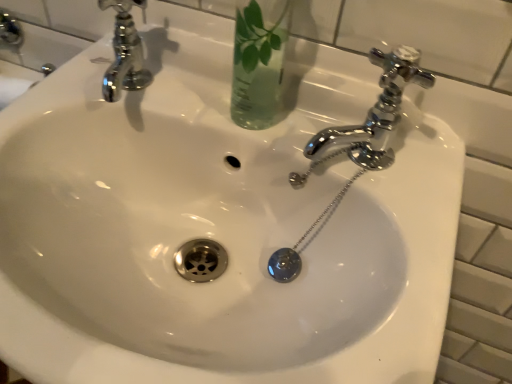
In order to face chrome/metallic faucet at right, should I rotate leftwards or rightwards?

You should rotate right by 17.047 degrees.

I want to click on chrome/metallic faucet at right, so click(x=377, y=111).

The width and height of the screenshot is (512, 384). What do you see at coordinates (377, 111) in the screenshot?
I see `chrome/metallic faucet at right` at bounding box center [377, 111].

This screenshot has width=512, height=384. I want to click on transparent glass vase at upper center, so 258,62.

What do you see at coordinates (258, 62) in the screenshot?
I see `transparent glass vase at upper center` at bounding box center [258, 62].

Based on the photo, in order to face transparent glass vase at upper center, should I rotate leftwards or rightwards?

A 2.742 degree turn to the right will do.

Where is `chrome/metallic faucet at right`? The image size is (512, 384). chrome/metallic faucet at right is located at coordinates (377, 111).

Between transparent glass vase at upper center and chrome/metallic faucet at right, which one appears on the left side from the viewer's perspective?

transparent glass vase at upper center is more to the left.

Considering the positions of objects transparent glass vase at upper center and chrome/metallic faucet at right in the image provided, who is in front, transparent glass vase at upper center or chrome/metallic faucet at right?

transparent glass vase at upper center is closer to the camera.

Which is farther, [240,24] or [371,146]?

Point [371,146]

From the image's perspective, which one is positioned lower, transparent glass vase at upper center or chrome/metallic faucet at right?

chrome/metallic faucet at right is shown below in the image.

From a real-world perspective, who is located lower, transparent glass vase at upper center or chrome/metallic faucet at right?

chrome/metallic faucet at right.

Which of these two, transparent glass vase at upper center or chrome/metallic faucet at right, is wider?

With larger width is transparent glass vase at upper center.

Looking at this image, does transparent glass vase at upper center have a greater height compared to chrome/metallic faucet at right?

Correct, transparent glass vase at upper center is much taller as chrome/metallic faucet at right.

Which of these two, transparent glass vase at upper center or chrome/metallic faucet at right, is bigger?

transparent glass vase at upper center.

Would you say transparent glass vase at upper center is inside or outside chrome/metallic faucet at right?

transparent glass vase at upper center is not enclosed by chrome/metallic faucet at right.

Is transparent glass vase at upper center with chrome/metallic faucet at right?

They are not placed beside each other.

Is transparent glass vase at upper center facing away from chrome/metallic faucet at right?

No, transparent glass vase at upper center's orientation is not away from chrome/metallic faucet at right.

What's the angular difference between transparent glass vase at upper center and chrome/metallic faucet at right's facing directions?

The angle between the facing direction of transparent glass vase at upper center and the facing direction of chrome/metallic faucet at right is 0.0103 degrees.

Where is `tap that is on the right side of transparent glass vase at upper center`? tap that is on the right side of transparent glass vase at upper center is located at coordinates (377, 111).

Is chrome/metallic faucet at right at the right side of transparent glass vase at upper center?

Correct, you'll find chrome/metallic faucet at right to the right of transparent glass vase at upper center.

Does chrome/metallic faucet at right come behind transparent glass vase at upper center?

Yes, chrome/metallic faucet at right is further from the camera.

Is point (393, 76) positioned behind point (252, 38)?

Yes, point (393, 76) is farther from viewer.

From the image's perspective, between chrome/metallic faucet at right and transparent glass vase at upper center, who is located below?

chrome/metallic faucet at right, from the image's perspective.

From a real-world perspective, between chrome/metallic faucet at right and transparent glass vase at upper center, who is vertically lower?

chrome/metallic faucet at right, from a real-world perspective.

Is chrome/metallic faucet at right wider than transparent glass vase at upper center?

In fact, chrome/metallic faucet at right might be narrower than transparent glass vase at upper center.

Who is taller, chrome/metallic faucet at right or transparent glass vase at upper center?

transparent glass vase at upper center.

Looking at the image, does chrome/metallic faucet at right seem bigger or smaller compared to transparent glass vase at upper center?

chrome/metallic faucet at right is smaller than transparent glass vase at upper center.

Is transparent glass vase at upper center a part of chrome/metallic faucet at right?

Actually, transparent glass vase at upper center is outside chrome/metallic faucet at right.

From the picture: Is chrome/metallic faucet at right positioned far away from transparent glass vase at upper center?

They are positioned close to each other.

Is chrome/metallic faucet at right oriented away from transparent glass vase at upper center?

chrome/metallic faucet at right does not have its back to transparent glass vase at upper center.

The height and width of the screenshot is (384, 512). I want to click on glass vase that appears in front of the chrome/metallic faucet at right, so click(258, 62).

Where is `tap directly beneath the transparent glass vase at upper center (from a real-world perspective)`? The height and width of the screenshot is (384, 512). tap directly beneath the transparent glass vase at upper center (from a real-world perspective) is located at coordinates (377, 111).

You are a GUI agent. You are given a task and a screenshot of the screen. Output one action in this format:
    pyautogui.click(x=<x>, y=<y>)
    Task: Click on the glass vase above the chrome/metallic faucet at right (from the image's perspective)
    
    Given the screenshot: What is the action you would take?
    pyautogui.click(x=258, y=62)